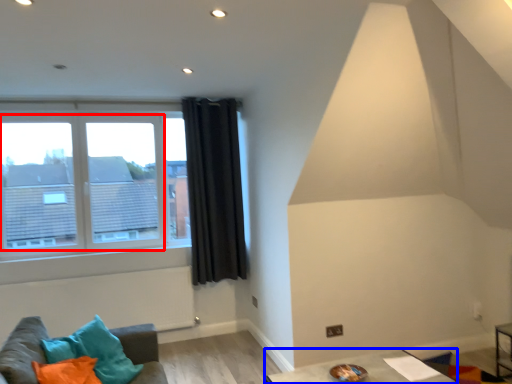
Question: Which point is further to the camera, bay window (highlighted by a red box) or table (highlighted by a blue box)?

Choices:
 (A) bay window
 (B) table

Answer: (A)